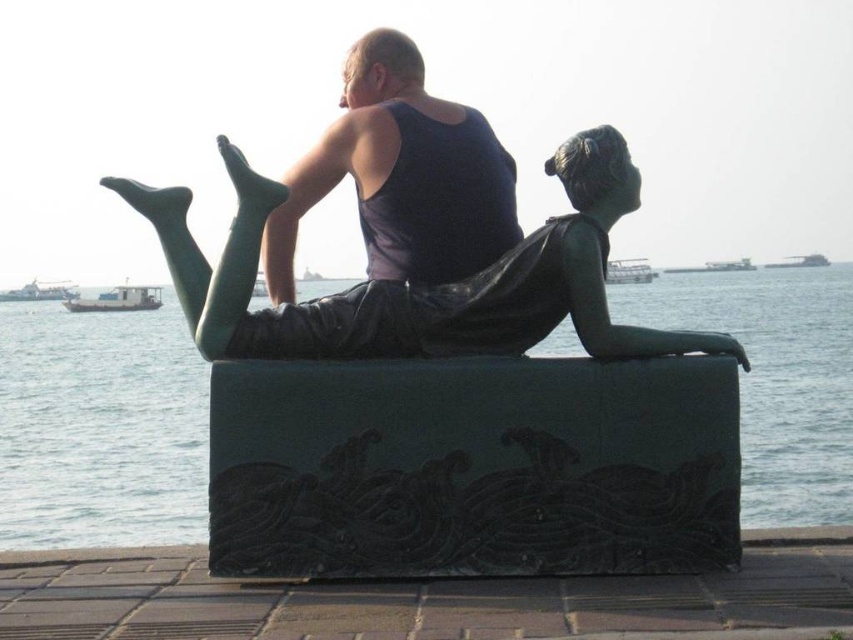
Question: Can you confirm if green stone water at center is positioned to the right of white plastic boat at upper center?

Choices:
 (A) no
 (B) yes

Answer: (A)

Question: Which of the following is the closest to the observer?

Choices:
 (A) matte black tank top at center
 (B) metallic gray boat at upper center
 (C) bronze statue of woman at center
 (D) white glossy boat at left

Answer: (C)

Question: Based on their relative distances, which object is farther from the green stone water at center?

Choices:
 (A) black stone dock at lower center
 (B) green matte boat at left
 (C) white glossy boat at left
 (D) white plastic boat at upper center

Answer: (A)

Question: Can you confirm if matte black tank top at center is bigger than white glossy boat at left?

Choices:
 (A) yes
 (B) no

Answer: (A)

Question: Which object is farther from the camera taking this photo?

Choices:
 (A) matte black tank top at center
 (B) metallic gray ship at upper center
 (C) green stone water at center

Answer: (B)

Question: From the image, what is the correct spatial relationship of black stone dock at lower center in relation to metallic gray boat at upper center?

Choices:
 (A) right
 (B) left

Answer: (B)